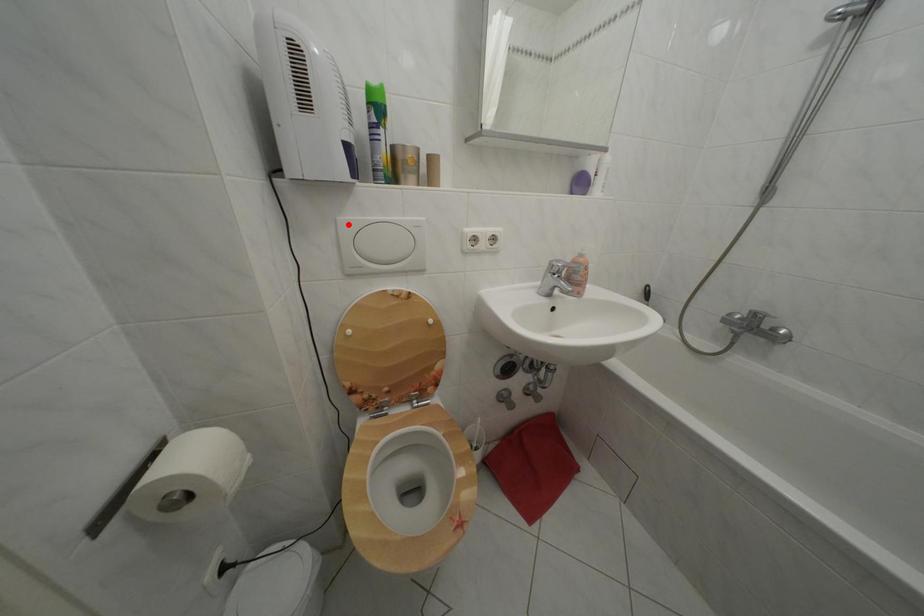
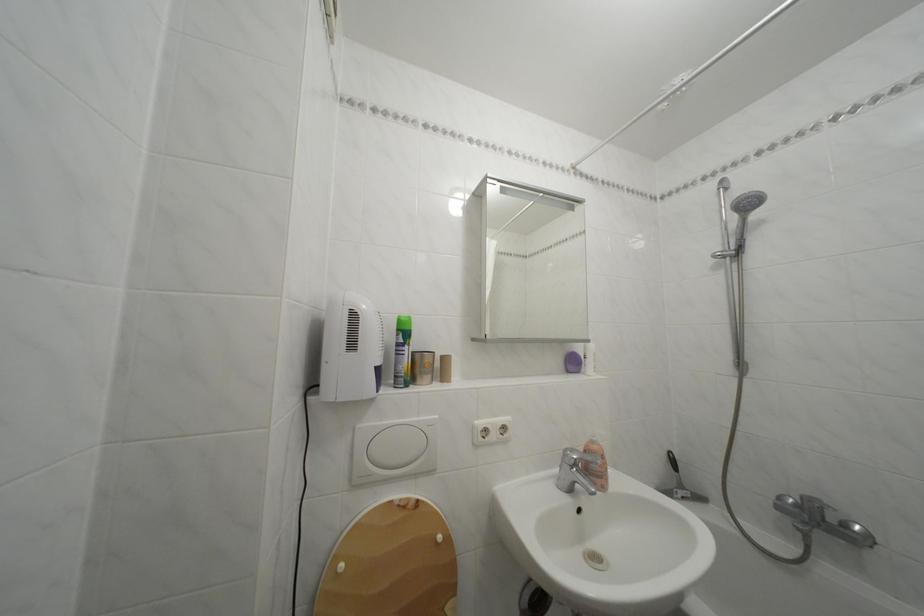
Find the pixel in the second image that matches the highlighted location in the first image.

(368, 432)